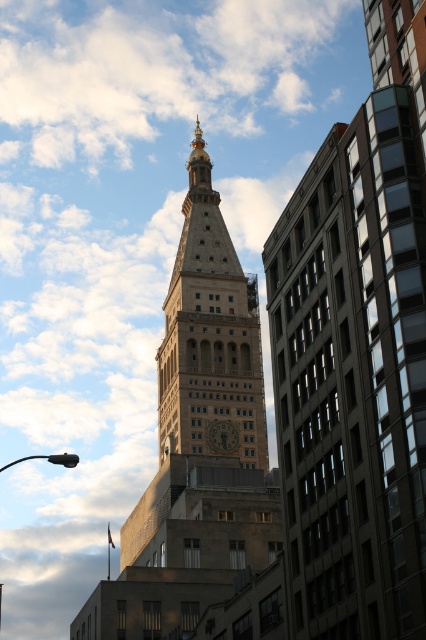
Is golden stone clock tower at center bigger than gold metallic clock at center?

Correct, golden stone clock tower at center is larger in size than gold metallic clock at center.

Does point (256, 435) lie in front of point (233, 449)?

No.

What are the coordinates of `golden stone clock tower at center` in the screenshot? It's located at (210, 333).